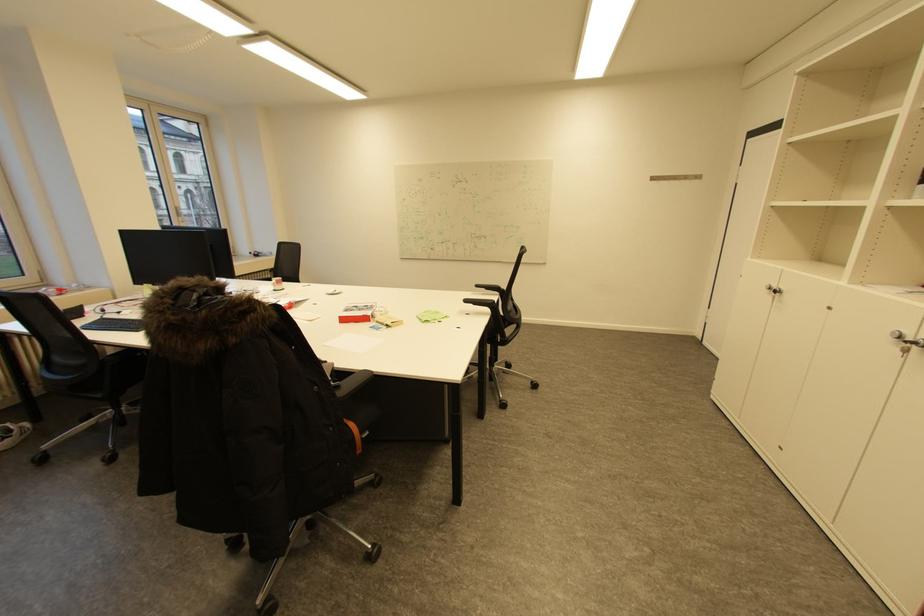
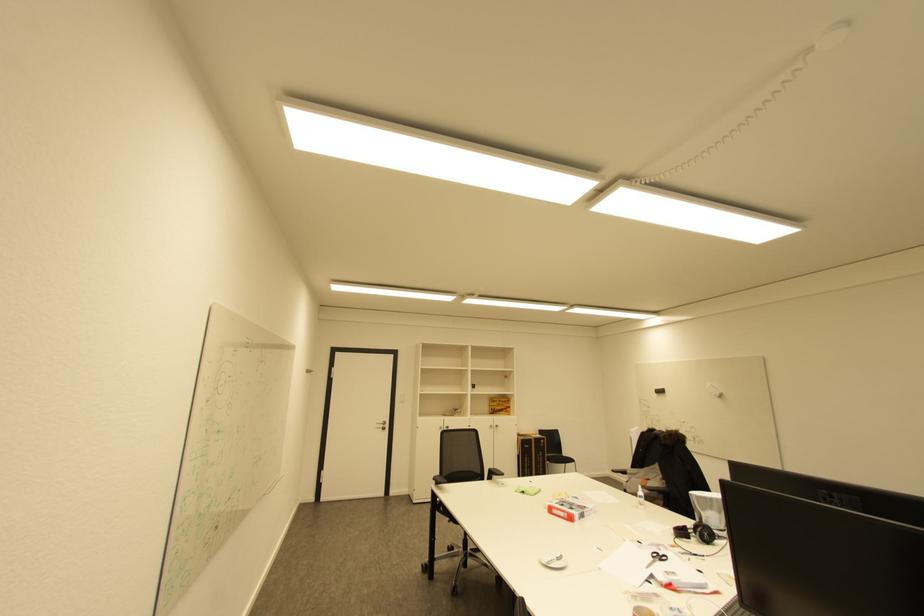
Find the pixel in the second image that matches [372,307] in the first image.

(568, 506)